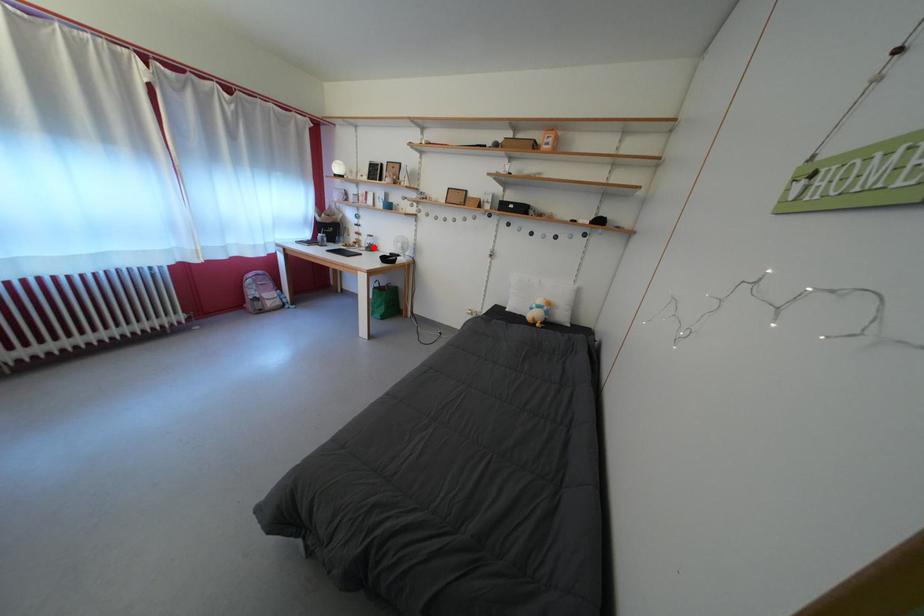
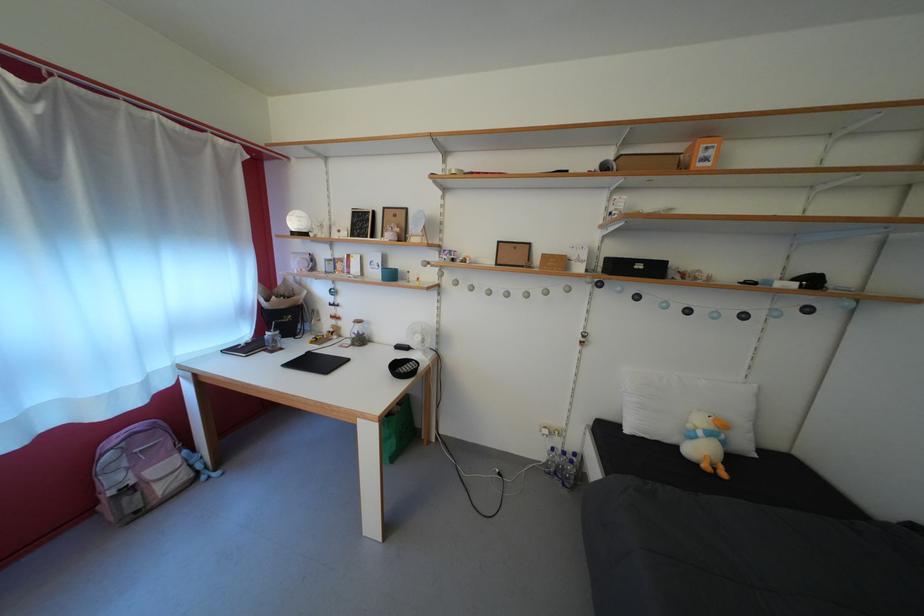
Question: I am providing you with two images of the same scene from different viewpoints. A red point is shown in image1. For the corresponding object point in image2, is it positioned nearer or farther from the camera?

Choices:
 (A) Nearer
 (B) Farther

Answer: (B)